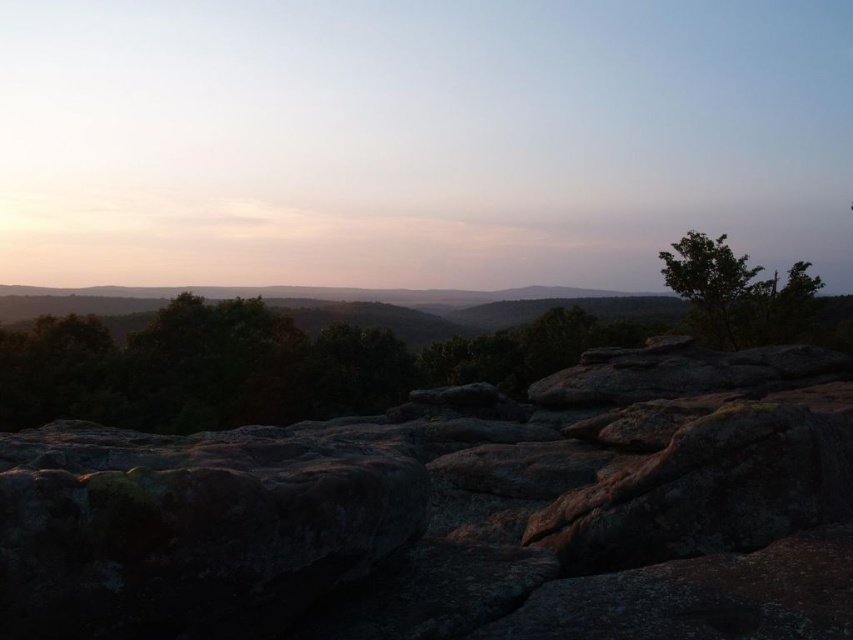
You are an explorer navigating through the rocky terrain and want to reach the green leafy tree at upper right. Which direction should you move relative to the green leafy tree at center?

To reach the green leafy tree at upper right from the green leafy tree at center, you should move to the right since the green leafy tree at center is to the left of the green leafy tree at upper right.

You are an environmental scientist assessing the biodiversity of this landscape. You observe the green leafy tree at center and the green leafy tree at upper right. Which tree has a wider canopy? Please base your answer on the visible characteristics in the image.

The green leafy tree at center has a wider canopy than the green leafy tree at upper right.